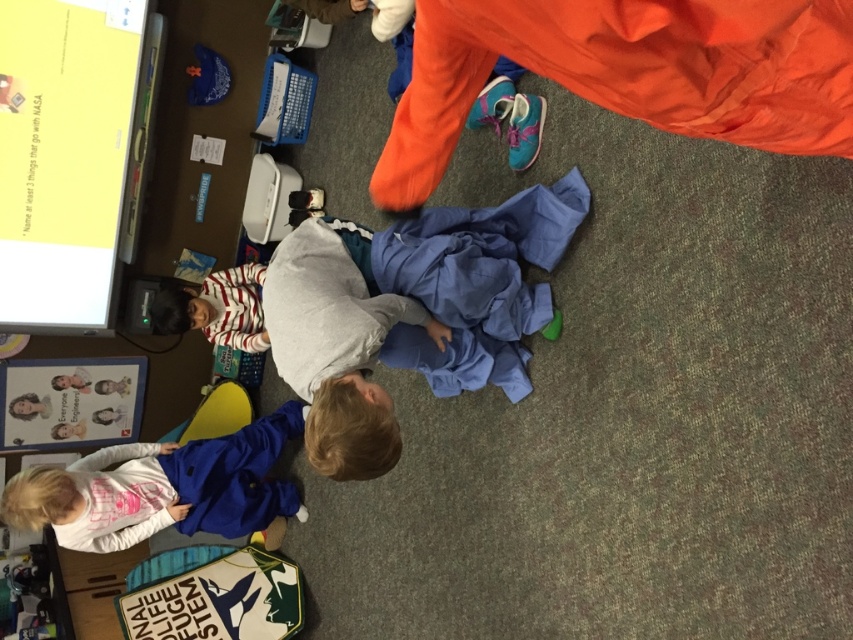
You are a student in the classroom and need to reach the gray soft shirt at center. Which direction should you move to get closer to it?

The gray soft shirt at center is located at point (337, 342), so you should move towards the center of the room to reach it.

You are a student in the classroom and need to decide which item to take first. The gray soft shirt at center and the blue fabric jacket at lower left are both on the floor. Which one is wider?

The blue fabric jacket at lower left is wider than the gray soft shirt at center.

You are a teacher who needs to move a gray soft shirt at center to the blue fabric jacket at lower left. Can you walk directly between them without bending down?

The distance between the gray soft shirt at center and the blue fabric jacket at lower left is 1.32 meters. Since the path is clear, you can walk directly between them without bending down.